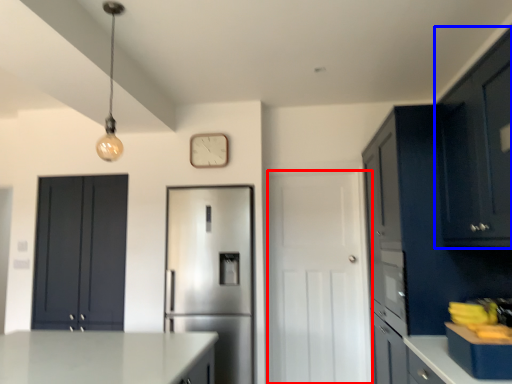
Question: Among these objects, which one is farthest to the camera, door (highlighted by a red box) or cabinetry (highlighted by a blue box)?

Choices:
 (A) door
 (B) cabinetry

Answer: (A)